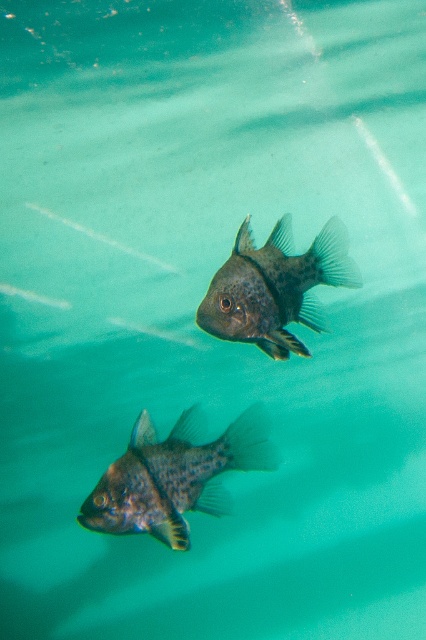
Question: Which point is closer to the camera?

Choices:
 (A) (161, 508)
 (B) (264, 342)

Answer: (A)

Question: Is speckled dark fish at bottom left above speckled dark fish at center?

Choices:
 (A) no
 (B) yes

Answer: (A)

Question: Which of the following is the closest to the observer?

Choices:
 (A) speckled dark fish at bottom left
 (B) speckled dark fish at center

Answer: (B)

Question: Which point is closer to the camera taking this photo?

Choices:
 (A) (186, 465)
 (B) (247, 234)

Answer: (B)

Question: Can you confirm if speckled dark fish at bottom left is bigger than speckled dark fish at center?

Choices:
 (A) yes
 (B) no

Answer: (A)

Question: Can you confirm if speckled dark fish at bottom left is positioned above speckled dark fish at center?

Choices:
 (A) no
 (B) yes

Answer: (A)